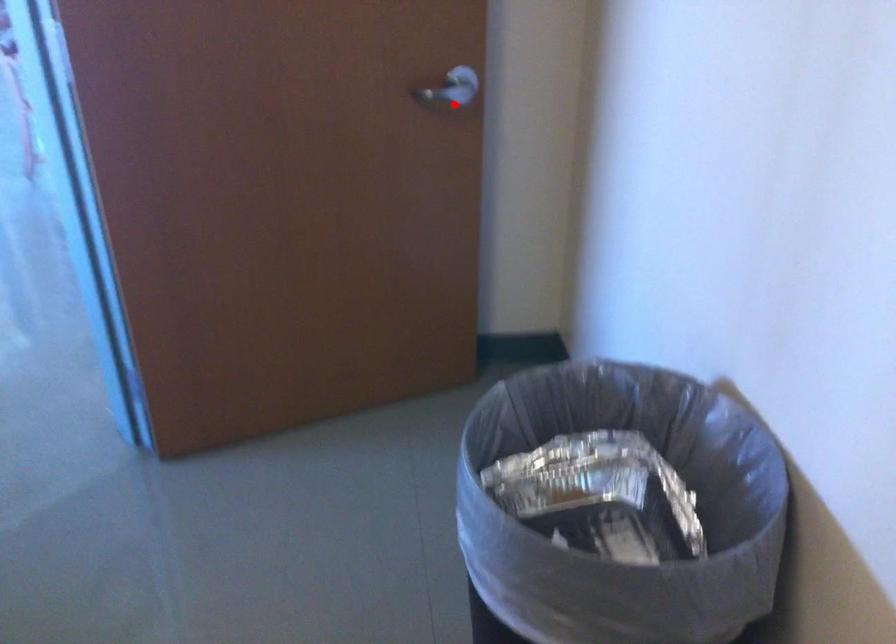
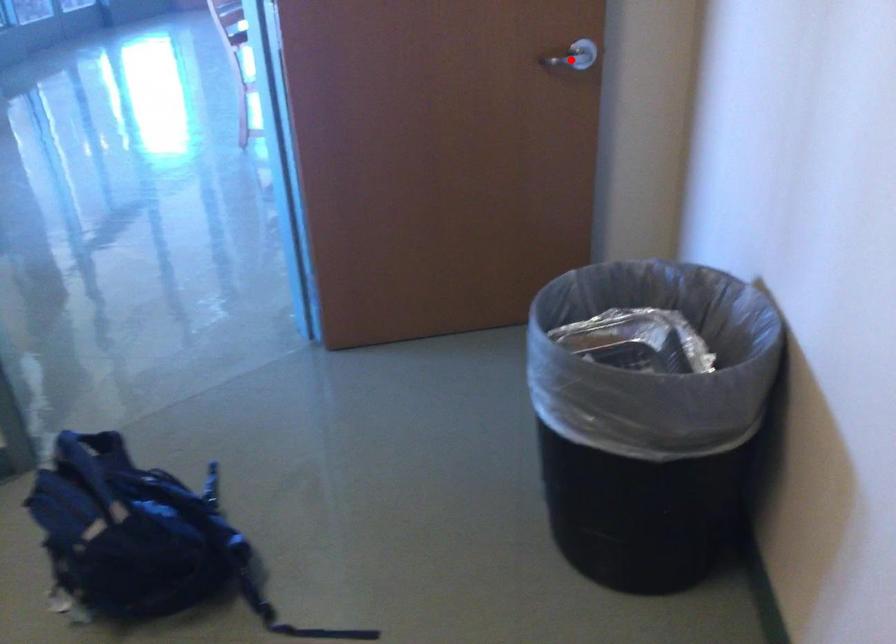
I am providing you with two images of the same scene from different viewpoints. A red point is marked on the first image and another point is marked on the second image. Do the highlighted points in image1 and image2 indicate the same real-world spot?

Yes